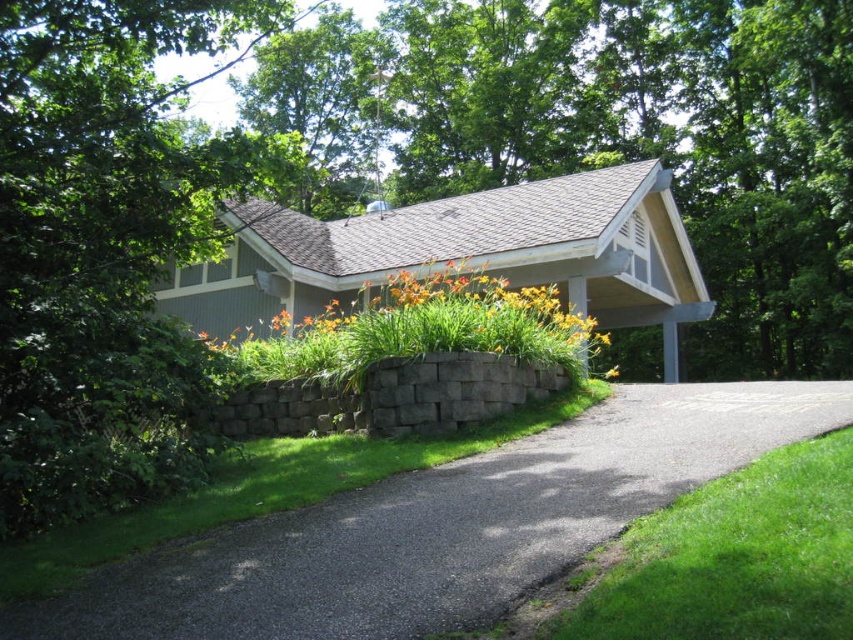
Question: Can you confirm if yellow-green leafy plant at center is positioned above yellow matte flower at center?

Choices:
 (A) no
 (B) yes

Answer: (B)

Question: Among these points, which one is nearest to the camera?

Choices:
 (A) (618, 365)
 (B) (432, 272)
 (C) (134, 586)
 (D) (152, 92)

Answer: (C)

Question: Which object is positioned farthest from the yellow matte flower at center?

Choices:
 (A) gray asphalt driveway at center
 (B) yellow-green leafy plant at center

Answer: (A)

Question: Which object is the closest to the yellow-green leafy plant at center?

Choices:
 (A) yellow matte flower at center
 (B) gray asphalt driveway at center

Answer: (B)

Question: Is green leafy tree at left to the right of yellow-green leafy plant at center from the viewer's perspective?

Choices:
 (A) no
 (B) yes

Answer: (A)

Question: Is gray asphalt driveway at center in front of yellow matte flower at center?

Choices:
 (A) yes
 (B) no

Answer: (A)